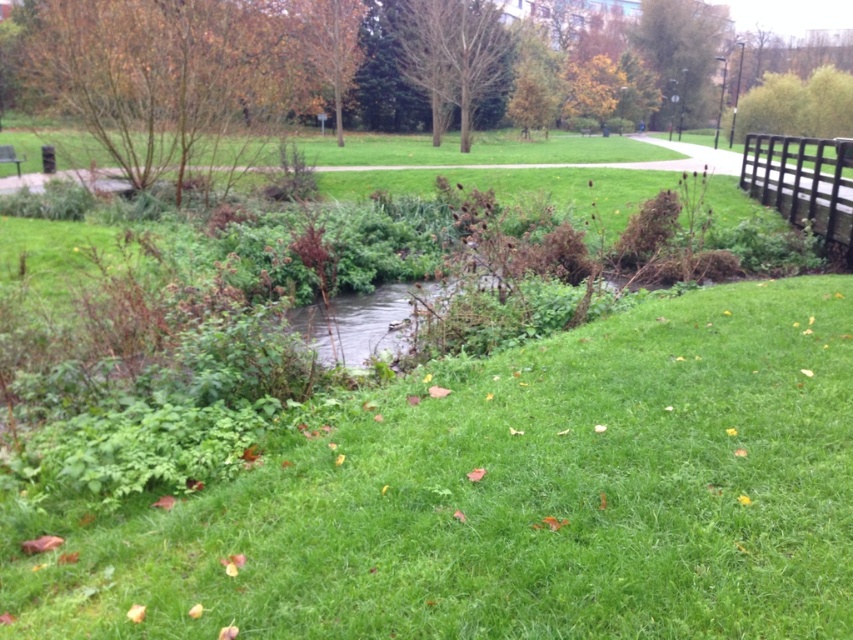
You are a park visitor standing at the entrance of the park. You see the brown leafy tree at upper left and the brown wooden fence at upper right. Which object is higher in the image?

The brown leafy tree at upper left is located above the brown wooden fence at upper right, so the brown leafy tree at upper left is higher in the image.